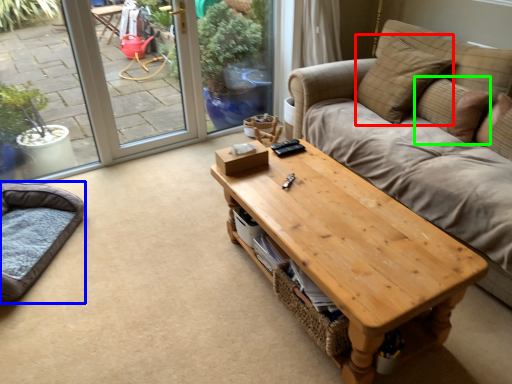
Question: Considering the real-world distances, which object is farthest from pillow (highlighted by a red box)? cat bed (highlighted by a blue box) or pillow (highlighted by a green box)?

Choices:
 (A) cat bed
 (B) pillow

Answer: (A)